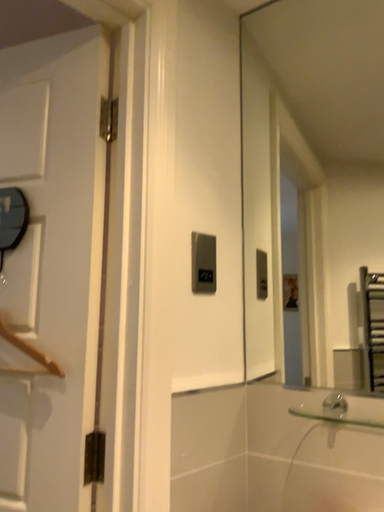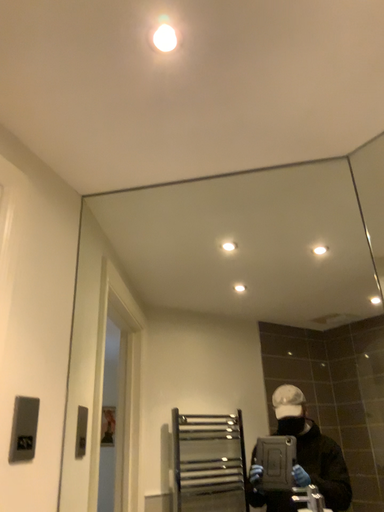
Question: Which way did the camera rotate in the video?

Choices:
 (A) rotated left
 (B) rotated right

Answer: (B)